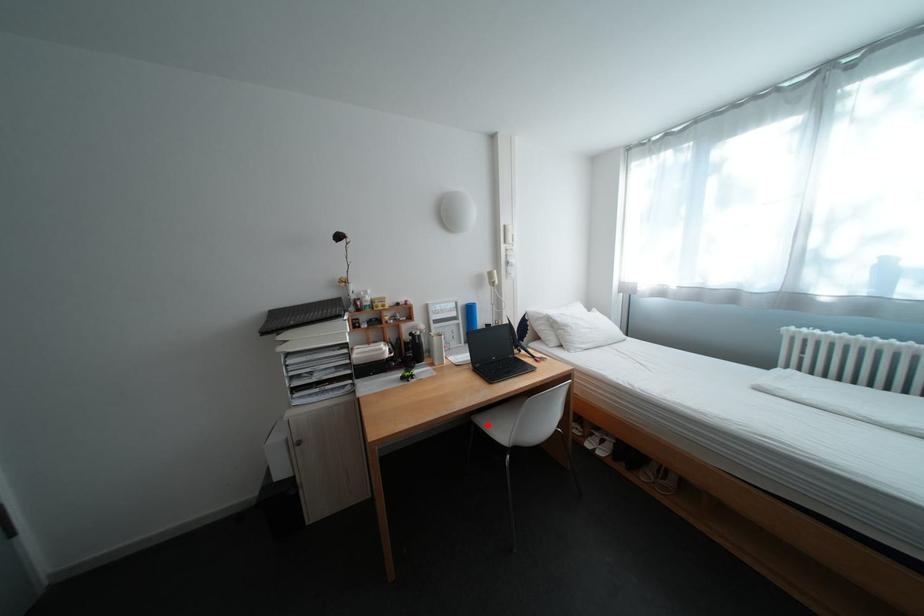
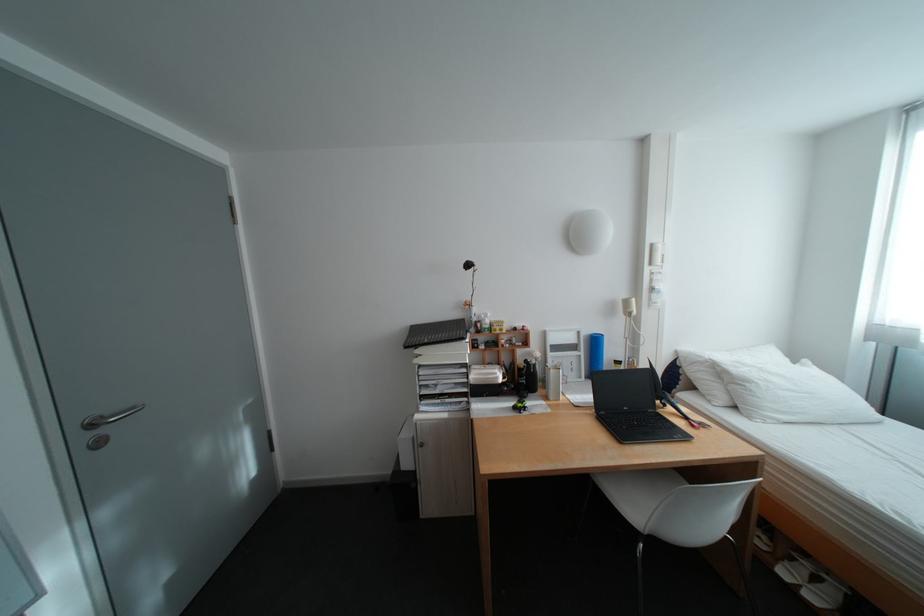
Question: A red point is marked in image1. In image2, is the corresponding 3D point closer to the camera or farther? Reply with the corresponding letter.

Choices:
 (A) The corresponding 3D point is closer.
 (B) The corresponding 3D point is farther.

Answer: (A)